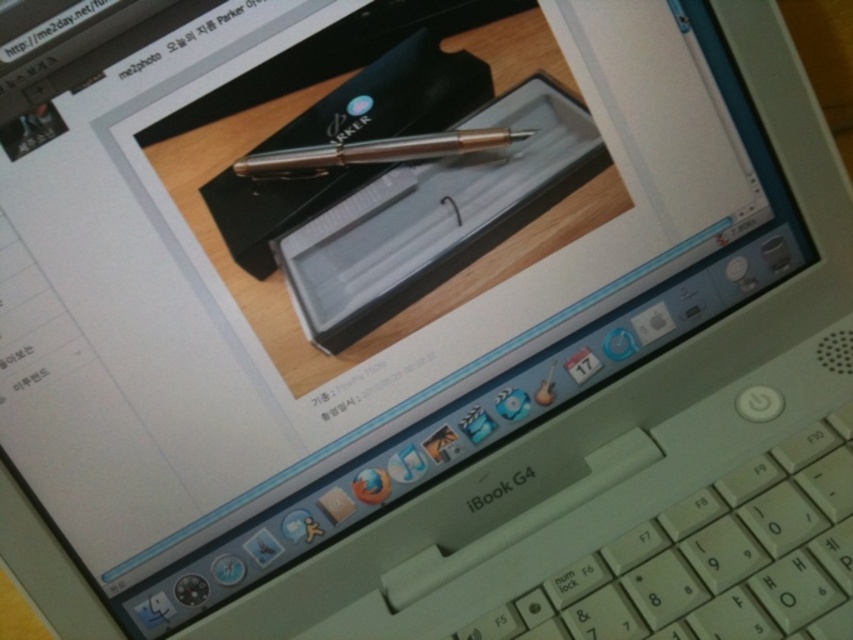
Question: Is white plastic keyboard at lower right positioned in front of gold metallic pen at center?

Choices:
 (A) yes
 (B) no

Answer: (A)

Question: Which object is farther from the camera taking this photo?

Choices:
 (A) white plastic keyboard at lower right
 (B) gold metallic pen at center

Answer: (B)

Question: Which of the following is the farthest from the observer?

Choices:
 (A) (x=306, y=168)
 (B) (x=827, y=621)

Answer: (A)

Question: Is white plastic keyboard at lower right thinner than gold metallic pen at center?

Choices:
 (A) yes
 (B) no

Answer: (B)

Question: Which of the following is the farthest from the observer?

Choices:
 (A) (399, 152)
 (B) (766, 472)

Answer: (A)

Question: Is the position of white plastic keyboard at lower right more distant than that of gold metallic pen at center?

Choices:
 (A) no
 (B) yes

Answer: (A)